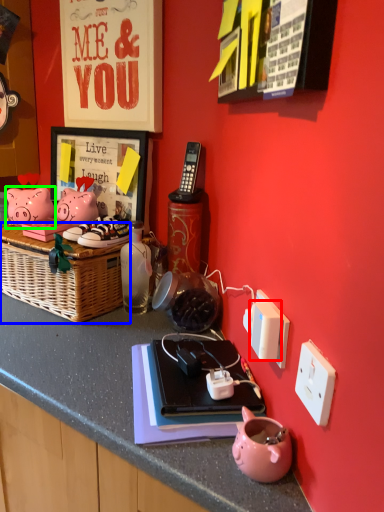
Question: Based on their relative distances, which object is farther from light switch (highlighted by a red box)? Choose from picnic basket (highlighted by a blue box) and pig (highlighted by a green box).

Choices:
 (A) picnic basket
 (B) pig

Answer: (B)